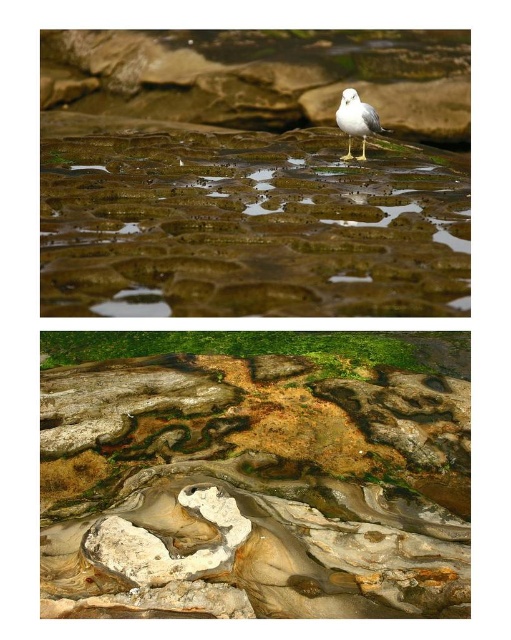
Question: Does rough textured rock at center appear under white matte bird at center?

Choices:
 (A) no
 (B) yes

Answer: (B)

Question: Estimate the real-world distances between objects in this image. Which object is closer to the translucent wet rock at center?

Choices:
 (A) white matte bird at center
 (B) rough textured rock at center

Answer: (A)

Question: Considering the real-world distances, which object is farthest from the translucent wet rock at center?

Choices:
 (A) rough textured rock at center
 (B) white matte bird at center

Answer: (A)

Question: Does rough textured rock at center appear on the right side of translucent wet rock at center?

Choices:
 (A) no
 (B) yes

Answer: (A)

Question: Is translucent wet rock at center above white matte bird at center?

Choices:
 (A) yes
 (B) no

Answer: (B)

Question: Which point is closer to the camera taking this photo?

Choices:
 (A) (361, 157)
 (B) (146, 214)
 (C) (158, 483)

Answer: (B)